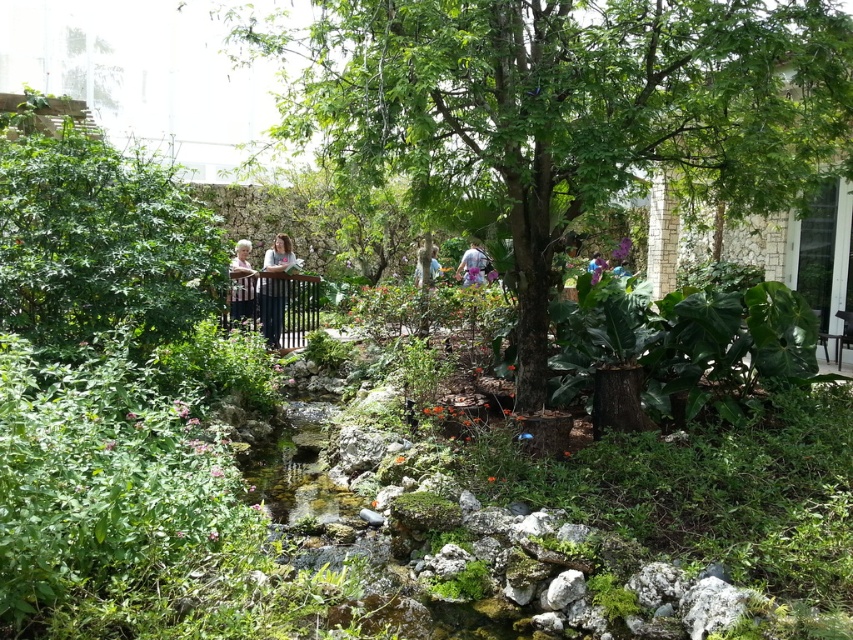
Between black metal rail at center and matte gray hair at center, which one is positioned lower?

black metal rail at center is lower down.

Is the position of black metal rail at center less distant than that of matte gray hair at center?

No, black metal rail at center is behind matte gray hair at center.

At what (x,y) coordinates should I click in order to perform the action: click on black metal rail at center. Please return your answer as a coordinate pair (x, y). This screenshot has width=853, height=640. Looking at the image, I should click on (277, 305).

Locate an element on the screen. The image size is (853, 640). black metal rail at center is located at coordinates (277, 305).

Does green leafy tree at center appear over light purple fabric at center?

Actually, green leafy tree at center is below light purple fabric at center.

Find the location of a particular element. green leafy tree at center is located at coordinates (561, 109).

The height and width of the screenshot is (640, 853). What do you see at coordinates (561, 109) in the screenshot?
I see `green leafy tree at center` at bounding box center [561, 109].

Identify the location of green leafy tree at center. The height and width of the screenshot is (640, 853). (561, 109).

Is the position of matte gray hair at center less distant than that of light blue shirt at center?

That is True.

The width and height of the screenshot is (853, 640). What do you see at coordinates (241, 284) in the screenshot?
I see `matte gray hair at center` at bounding box center [241, 284].

The image size is (853, 640). I want to click on matte gray hair at center, so click(241, 284).